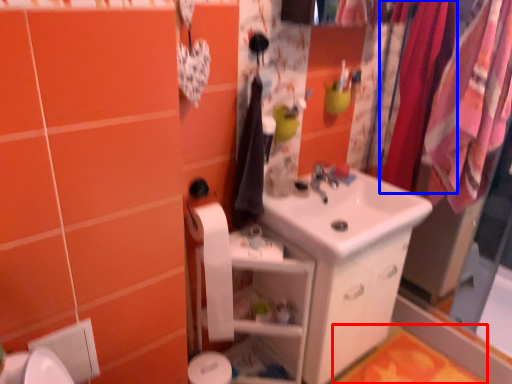
Question: Which object is closer to the camera taking this photo, bath mat (highlighted by a red box) or clothesline (highlighted by a blue box)?

Choices:
 (A) bath mat
 (B) clothesline

Answer: (B)